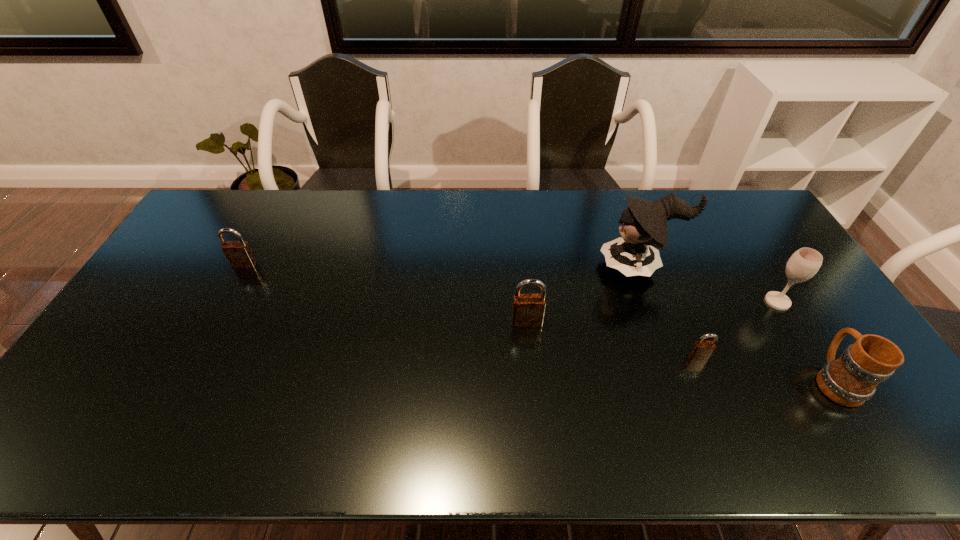
Image resolution: width=960 pixels, height=540 pixels. I want to click on wineglass that is at the right edge, so click(x=804, y=263).

The image size is (960, 540). What are the coordinates of `mug that is at the right edge` in the screenshot? It's located at (852, 379).

Image resolution: width=960 pixels, height=540 pixels. What are the coordinates of `object located in the near right corner section of the desktop` in the screenshot? It's located at (852, 379).

Image resolution: width=960 pixels, height=540 pixels. Identify the location of vacant space at the far edge of the desktop. (470, 190).

I want to click on free region at the near edge of the desktop, so click(x=786, y=403).

Where is `free space at the left edge`? This screenshot has width=960, height=540. free space at the left edge is located at coordinates (140, 333).

Locate an element on the screen. Image resolution: width=960 pixels, height=540 pixels. vacant space at the right edge is located at coordinates (782, 260).

What are the coordinates of `vacant area that lies between the doll and the farthest padlock` in the screenshot? It's located at (442, 265).

You are a GUI agent. You are given a task and a screenshot of the screen. Output one action in this format:
    pyautogui.click(x=<x>, y=<y>)
    Task: Click on the free space between the shortest object and the mug
    The image size is (960, 540).
    Given the screenshot: What is the action you would take?
    pyautogui.click(x=766, y=368)

The image size is (960, 540). I want to click on unoccupied position between the fifth object from right to left and the wineglass, so click(x=652, y=312).